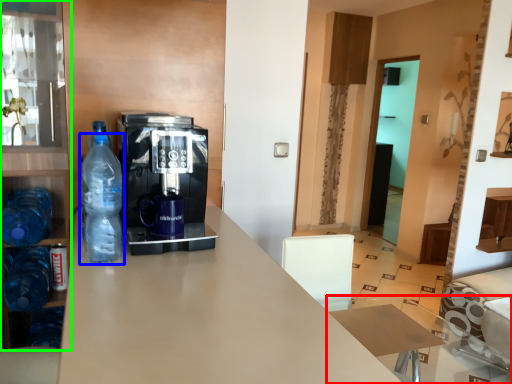
Question: Which is nearer to the table (highlighted by a red box)? bottle (highlighted by a blue box) or cabinetry (highlighted by a green box).

Choices:
 (A) bottle
 (B) cabinetry

Answer: (A)